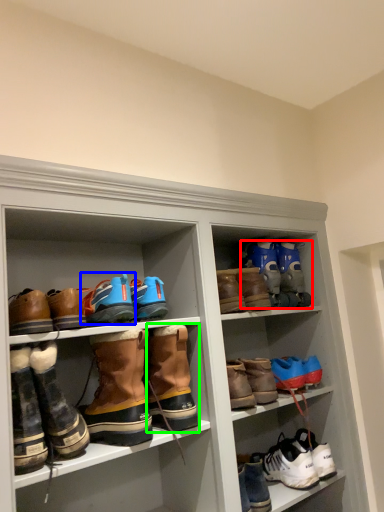
Question: Considering the real-world distances, which object is closest to footwear (highlighted by a red box)? footwear (highlighted by a blue box) or footwear (highlighted by a green box).

Choices:
 (A) footwear
 (B) footwear

Answer: (B)